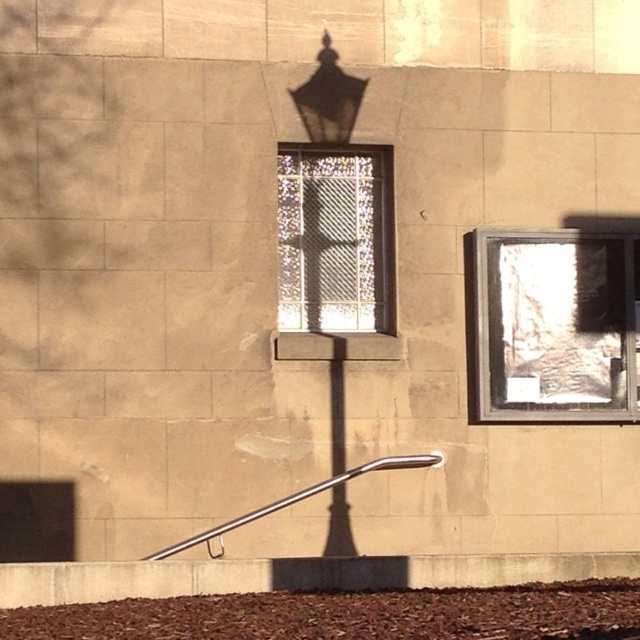
Is translucent glass window at center right positioned in front of satin silver rail at lower center?

No, translucent glass window at center right is further to the viewer.

Between translucent glass window at center right and satin silver rail at lower center, which one appears on the left side from the viewer's perspective?

satin silver rail at lower center

In order to click on translucent glass window at center right in this screenshot , I will do `click(556, 324)`.

Between point (339, 113) and point (227, 524), which one is positioned behind?

Point (339, 113)

Who is lower down, matte black lamp at upper center or satin silver rail at lower center?

satin silver rail at lower center is lower down.

I want to click on matte black lamp at upper center, so click(x=328, y=97).

I want to click on matte black lamp at upper center, so tap(328, 97).

In the scene shown: Is stained glass window at center bigger than satin silver rail at lower center?

Actually, stained glass window at center might be smaller than satin silver rail at lower center.

Is stained glass window at center positioned in front of satin silver rail at lower center?

No, stained glass window at center is further to the viewer.

Who is more distant from viewer, [289,192] or [330,483]?

The point [289,192] is behind.

The image size is (640, 640). What are the coordinates of `stained glass window at center` in the screenshot? It's located at (336, 240).